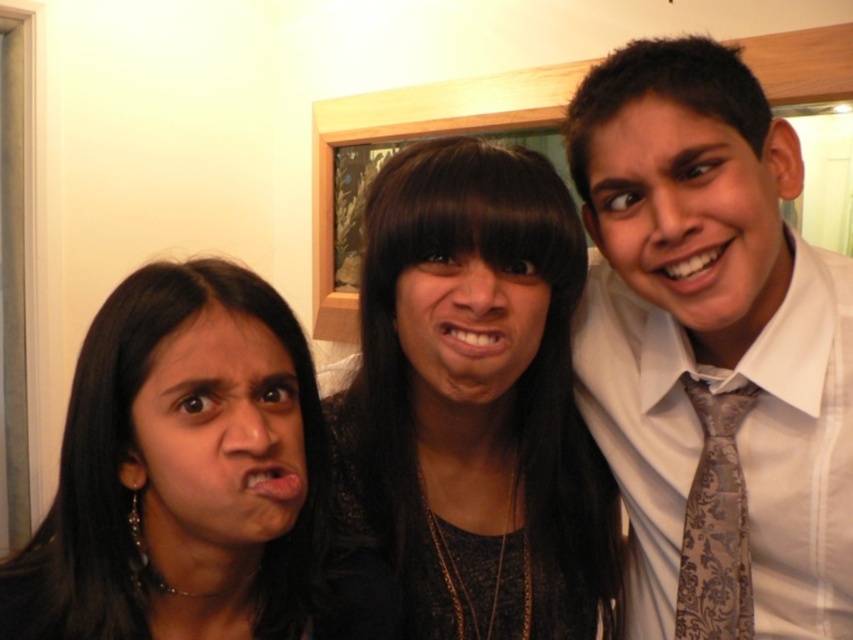
You are standing in the room where the three people are posing. You want to place a small gift exactly at the point with coordinates point (476,401). Which person is closest to that point?

The point (476,401) is on black lace dress at center, so the person wearing the black lace dress at center is closest to that point.